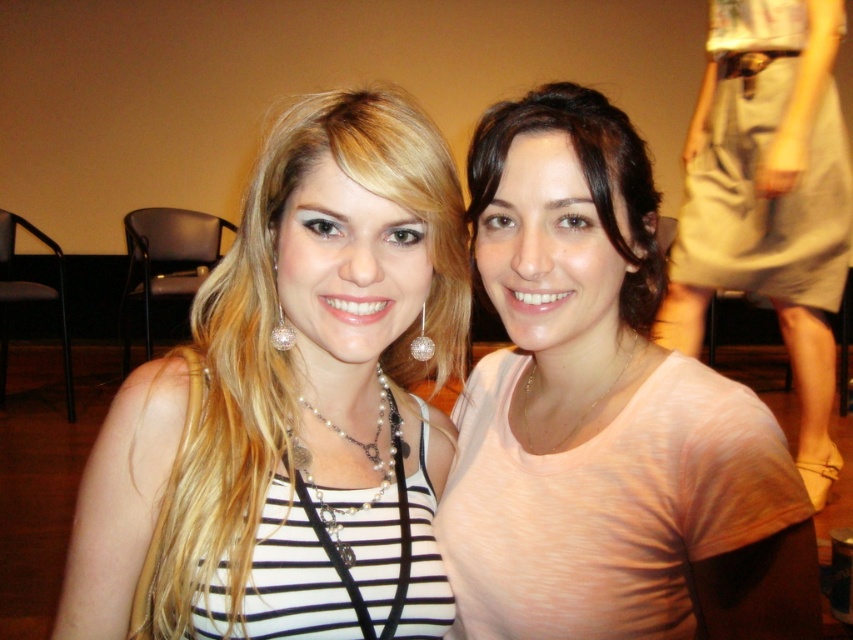
Between pink matte shirt at center and gold chain necklace at center, which one is positioned lower?

gold chain necklace at center is below.

Can you confirm if pink matte shirt at center is wider than gold chain necklace at center?

Yes, pink matte shirt at center is wider than gold chain necklace at center.

Who is more distant from viewer, (471, 628) or (612, 388)?

Point (471, 628)

Where is `pink matte shirt at center`? The image size is (853, 640). pink matte shirt at center is located at coordinates point(604,416).

Who is more forward, (299, 605) or (367, 445)?

Point (299, 605)

Is matte black top at center below pearl/chain necklace at center?

No, matte black top at center is not below pearl/chain necklace at center.

Does point (189, 545) come behind point (299, 400)?

No, it is in front of (299, 400).

Find the location of a particular element. matte black top at center is located at coordinates (289, 404).

Is pink matte shirt at center to the left of khaki cotton shorts at right from the viewer's perspective?

Yes, pink matte shirt at center is to the left of khaki cotton shorts at right.

Which is behind, point (448, 502) or point (821, 33)?

Point (821, 33)

I want to click on pink matte shirt at center, so click(x=604, y=416).